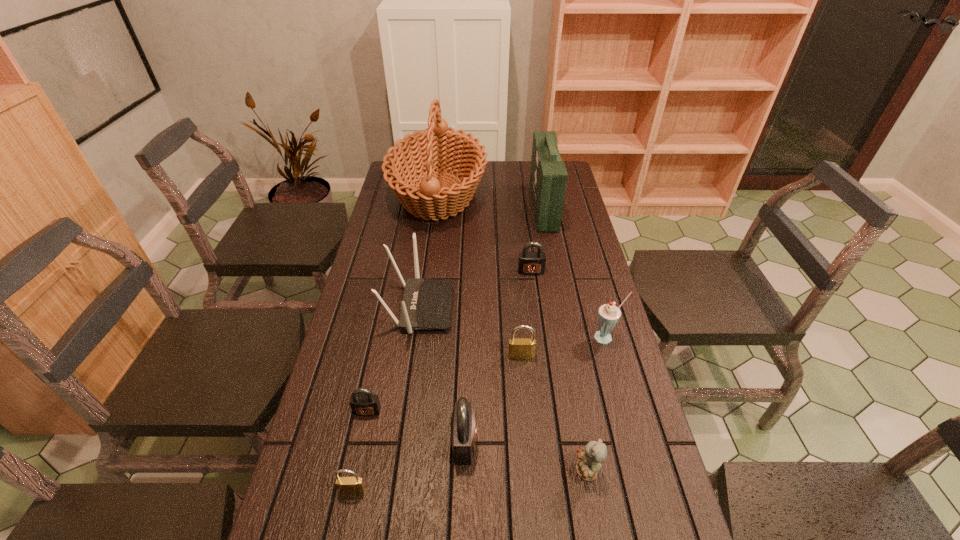
Locate an element on the screen. vacant space located on the front-facing side of the left brass padlock is located at coordinates (346, 525).

Image resolution: width=960 pixels, height=540 pixels. Identify the location of basket situated at the far edge. (439, 195).

Find the location of a particular element. the first-aid kit situated at the far edge is located at coordinates (548, 176).

This screenshot has height=540, width=960. Find the location of `basket that is at the left edge`. basket that is at the left edge is located at coordinates (439, 195).

The image size is (960, 540). What are the coordinates of `router present at the left edge` in the screenshot? It's located at (427, 303).

Identify the location of the first-aid kit that is at the right edge. (548, 176).

You are a GUI agent. You are given a task and a screenshot of the screen. Output one action in this format:
    pyautogui.click(x=<x>, y=<y>)
    Task: Click on the milkshake that is positioned at the right edge
    The image size is (960, 540).
    Given the screenshot: What is the action you would take?
    pyautogui.click(x=608, y=315)

The height and width of the screenshot is (540, 960). I want to click on teddy bear positioned at the right edge, so click(594, 453).

Identify the location of object present at the far left corner. (439, 195).

Locate an element on the screen. The width and height of the screenshot is (960, 540). object that is at the far right corner is located at coordinates (548, 176).